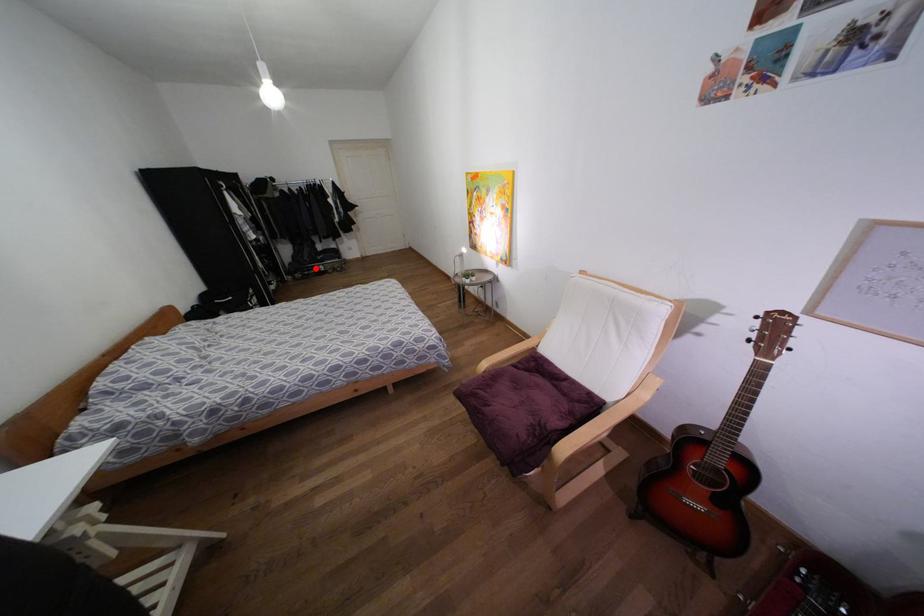
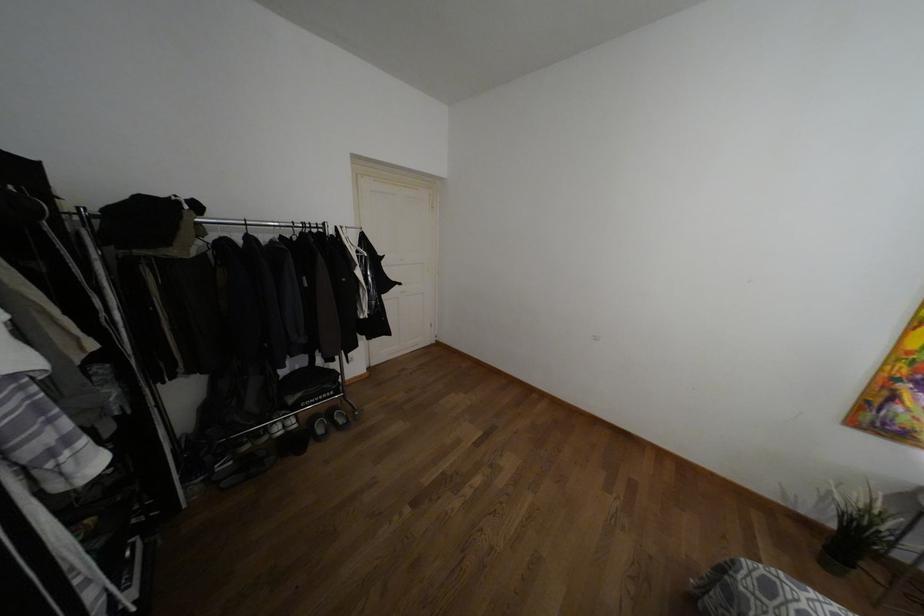
Question: I am providing you with two images of the same scene from different viewpoints. Given a red point in image1, look at the same physical point in image2. Is it:

Choices:
 (A) Closer to the viewpoint
 (B) Farther from the viewpoint

Answer: (B)